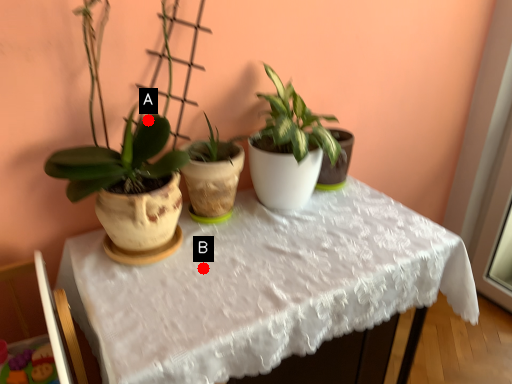
Question: Two points are circled on the image, labeled by A and B beside each circle. Among these points, which one is farthest from the camera?

Choices:
 (A) A is further
 (B) B is further

Answer: (B)